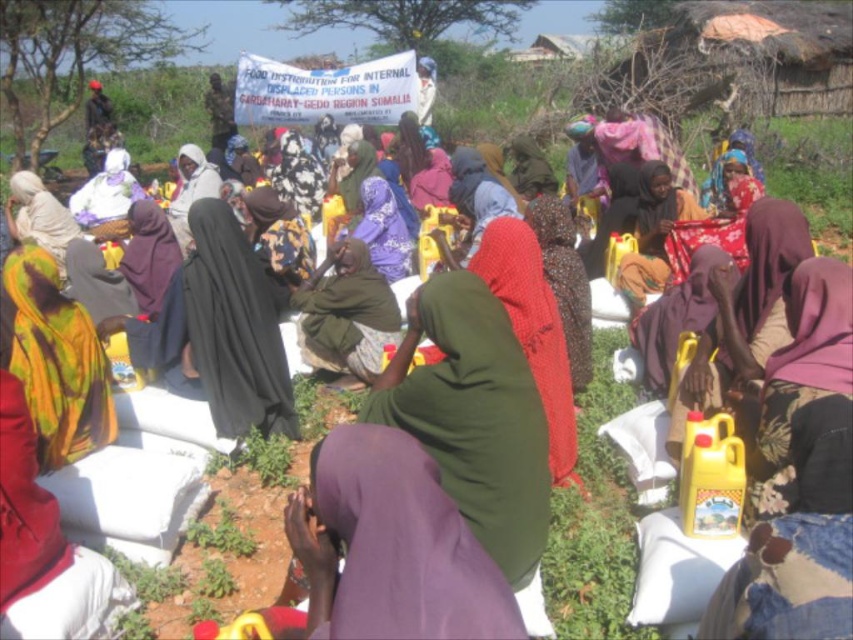
Question: Is black matte hijab at center smaller than dark green fabric at center?

Choices:
 (A) yes
 (B) no

Answer: (A)

Question: Considering the real-world distances, which object is farthest from the black matte hijab at center?

Choices:
 (A) printed fabric headscarf at lower left
 (B) matte purple scarf at center
 (C) dark green fabric at center
 (D) matte white headscarf at lower left

Answer: (D)

Question: Can you confirm if black matte hijab at center is wider than floral fabric hijab at center?

Choices:
 (A) yes
 (B) no

Answer: (A)

Question: Which object appears closest to the camera in this image?

Choices:
 (A) black matte hijab at center
 (B) floral fabric hijab at center

Answer: (B)

Question: Can you confirm if floral fabric hijab at center is positioned above dark green fabric at center?

Choices:
 (A) yes
 (B) no

Answer: (B)

Question: Which object is positioned closest to the matte white headscarf at lower left?

Choices:
 (A) printed fabric headscarf at lower left
 (B) black matte hijab at center
 (C) dark green fabric at center

Answer: (C)